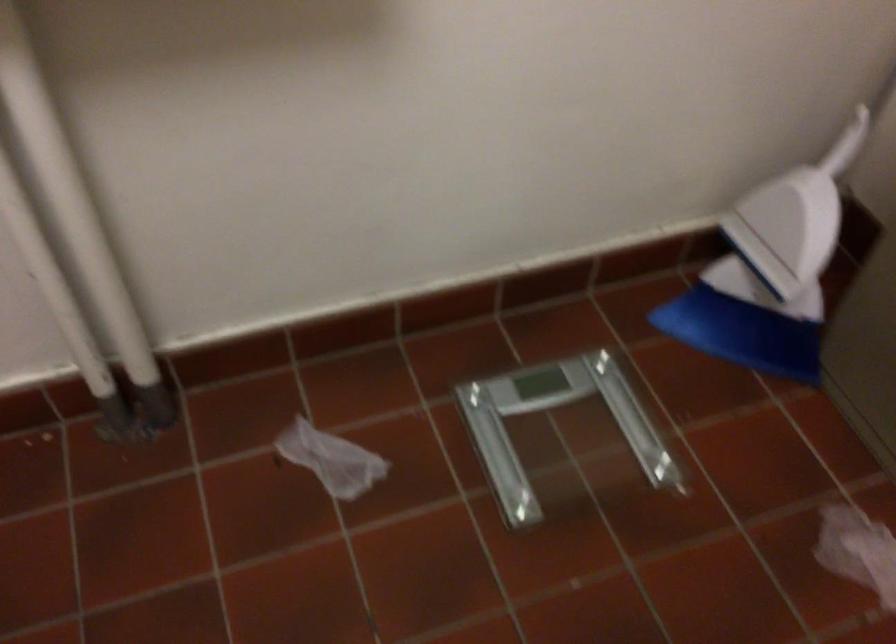
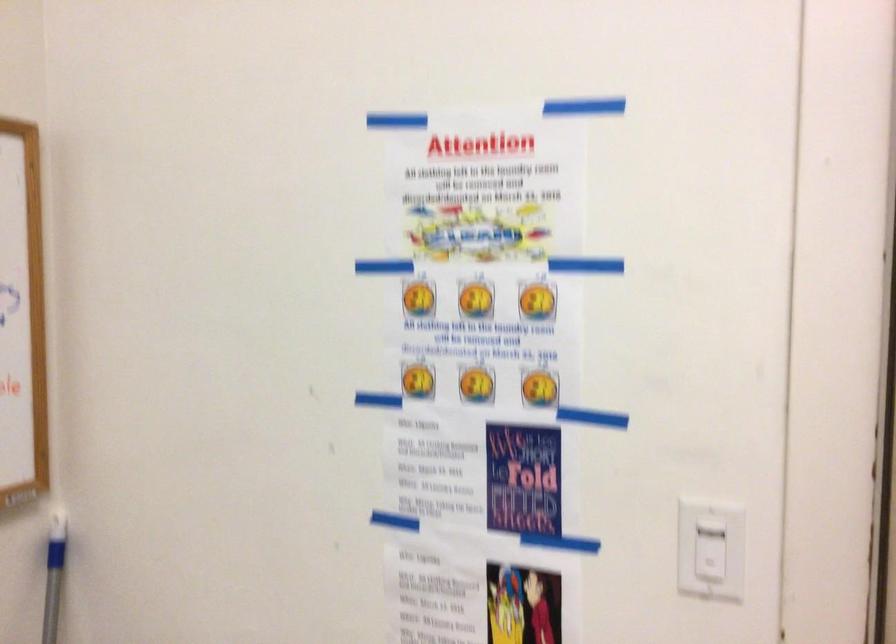
Question: In a continuous first-person perspective shot, in which direction is the camera moving?

Choices:
 (A) Left
 (B) Right
 (C) Forward
 (D) Backward

Answer: (D)